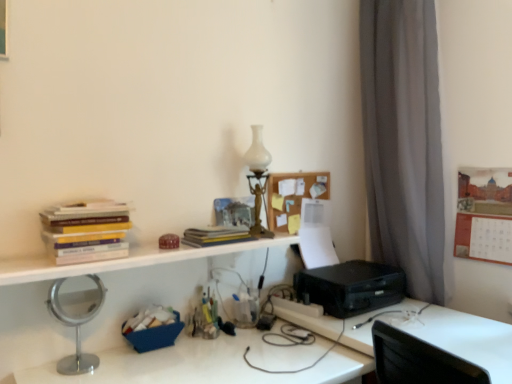
Question: Is there a large distance between silver metallic mirror at left and silver metallic mirror at lower left?

Choices:
 (A) yes
 (B) no

Answer: (B)

Question: Is silver metallic mirror at left smaller than silver metallic mirror at lower left?

Choices:
 (A) yes
 (B) no

Answer: (A)

Question: From a real-world perspective, is silver metallic mirror at left under silver metallic mirror at lower left?

Choices:
 (A) yes
 (B) no

Answer: (B)

Question: Is silver metallic mirror at left positioned before silver metallic mirror at lower left?

Choices:
 (A) no
 (B) yes

Answer: (A)

Question: Does silver metallic mirror at left lie behind silver metallic mirror at lower left?

Choices:
 (A) no
 (B) yes

Answer: (B)

Question: Is silver metallic mirror at left to the left of silver metallic mirror at lower left from the viewer's perspective?

Choices:
 (A) no
 (B) yes

Answer: (B)

Question: Is wooden bulletin board at upper right closer to camera compared to hardcover book at center?

Choices:
 (A) yes
 (B) no

Answer: (B)

Question: Is wooden bulletin board at upper right further to camera compared to hardcover book at center?

Choices:
 (A) yes
 (B) no

Answer: (A)

Question: Are wooden bulletin board at upper right and hardcover book at center making contact?

Choices:
 (A) yes
 (B) no

Answer: (B)

Question: From the image's perspective, is wooden bulletin board at upper right on top of hardcover book at center?

Choices:
 (A) yes
 (B) no

Answer: (A)

Question: Can you confirm if wooden bulletin board at upper right is smaller than hardcover book at center?

Choices:
 (A) yes
 (B) no

Answer: (B)

Question: Is wooden bulletin board at upper right facing towards hardcover book at center?

Choices:
 (A) yes
 (B) no

Answer: (A)

Question: From the image's perspective, would you say black plastic printer at right is shown under silver metallic mirror at lower left?

Choices:
 (A) no
 (B) yes

Answer: (A)